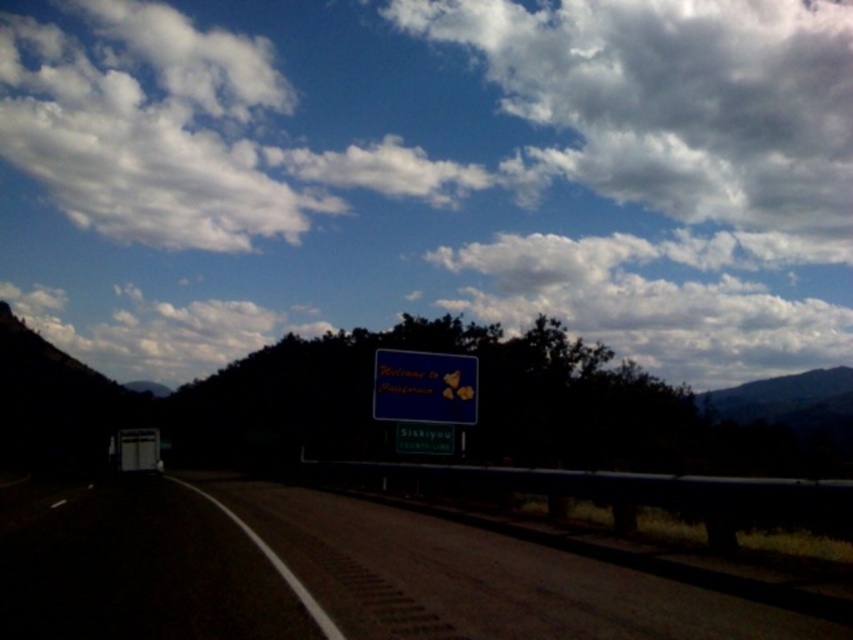
Is white fluffy cloud at upper center to the right of blue matte sign at center from the viewer's perspective?

Incorrect, white fluffy cloud at upper center is not on the right side of blue matte sign at center.

Identify the location of white fluffy cloud at upper center. (430, 173).

Does point (566, 305) lie behind point (412, 397)?

Yes, it is behind point (412, 397).

The width and height of the screenshot is (853, 640). I want to click on white fluffy cloud at upper center, so click(x=430, y=173).

Who is more forward, [381,637] or [451,400]?

Point [381,637]

Which is in front, point (363, 500) or point (419, 362)?

Positioned in front is point (363, 500).

Identify the location of dark asphalt road at center. (328, 573).

Between cloudy blue sky at upper center and green matte sign at center, which one has more height?

cloudy blue sky at upper center is taller.

Does cloudy blue sky at upper center have a larger size compared to green matte sign at center?

Indeed, cloudy blue sky at upper center has a larger size compared to green matte sign at center.

Between point (535, 156) and point (439, 429), which one is positioned behind?

The point (535, 156) is behind.

The height and width of the screenshot is (640, 853). What are the coordinates of `cloudy blue sky at upper center` in the screenshot? It's located at (679, 109).